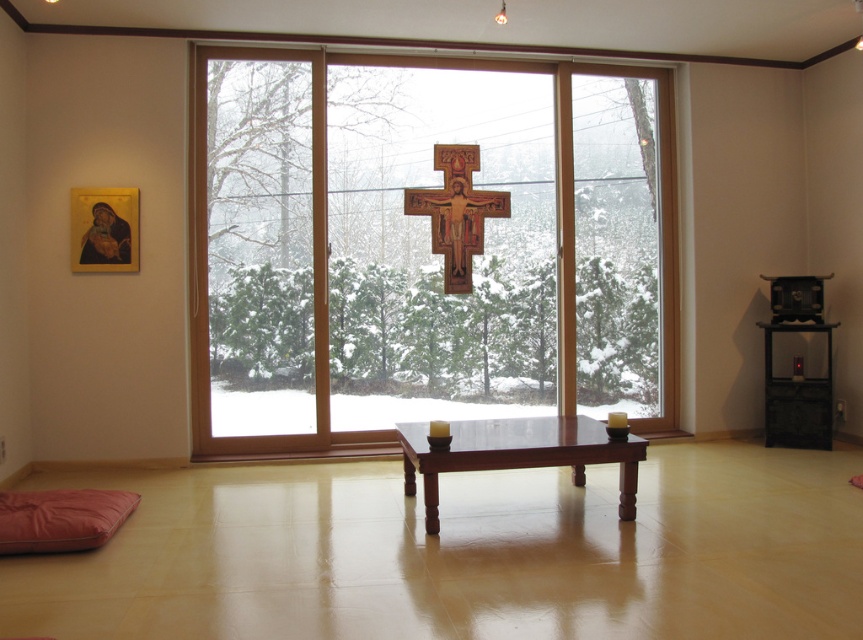
At what (x,y) coordinates should I click in order to perform the action: click on transparent wood glass door at center. Please return your answer as a coordinate pair (x, y). The height and width of the screenshot is (640, 863). Looking at the image, I should click on (426, 244).

Is point (502, 256) closer to viewer compared to point (127, 497)?

That is False.

Which is behind, point (225, 252) or point (7, 529)?

Positioned behind is point (225, 252).

Identify the location of transparent wood glass door at center. The height and width of the screenshot is (640, 863). click(426, 244).

Who is lower down, mahogany wood table at center or matte pink yoga mat at lower left?

matte pink yoga mat at lower left is below.

Does mahogany wood table at center come behind matte pink yoga mat at lower left?

Yes.

Is point (553, 424) positioned after point (16, 499)?

Yes, point (553, 424) is farther from viewer.

Find the location of a particular element. mahogany wood table at center is located at coordinates (518, 452).

Does point (486, 458) come closer to viewer compared to point (443, 161)?

Yes, point (486, 458) is closer to viewer.

Locate an element on the screen. This screenshot has width=863, height=640. mahogany wood table at center is located at coordinates (518, 452).

Who is more forward, (458,444) or (477,225)?

Point (458,444) is in front.

This screenshot has width=863, height=640. I want to click on mahogany wood table at center, so click(518, 452).